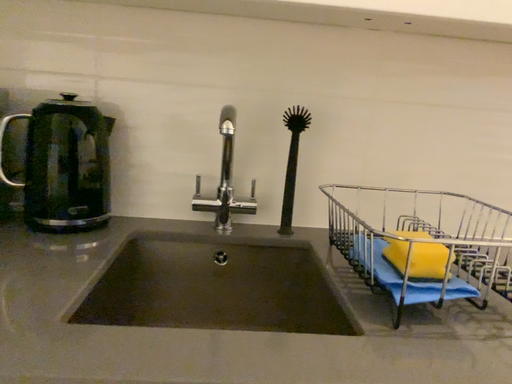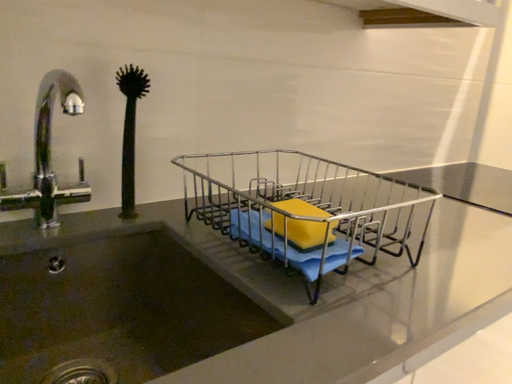
Question: How did the camera likely rotate when shooting the video?

Choices:
 (A) rotated left
 (B) rotated right

Answer: (B)